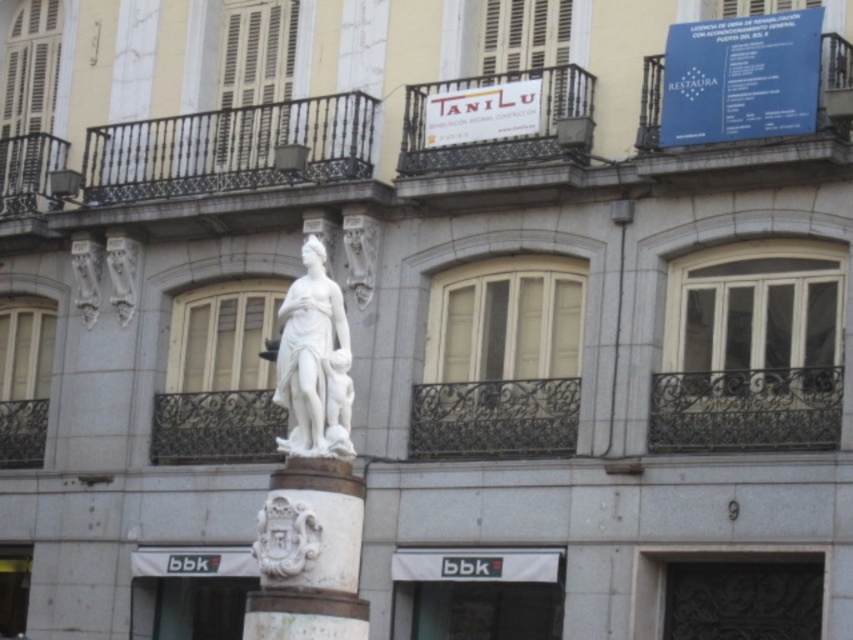
Does white stone column at center have a greater height compared to white marble statue at center?

Yes.

Between point (308, 481) and point (280, 316), which one is positioned in front?

Point (308, 481) is in front.

Describe the element at coordinates (308, 554) in the screenshot. The width and height of the screenshot is (853, 640). I see `white stone column at center` at that location.

Image resolution: width=853 pixels, height=640 pixels. Identify the location of white stone column at center. (308, 554).